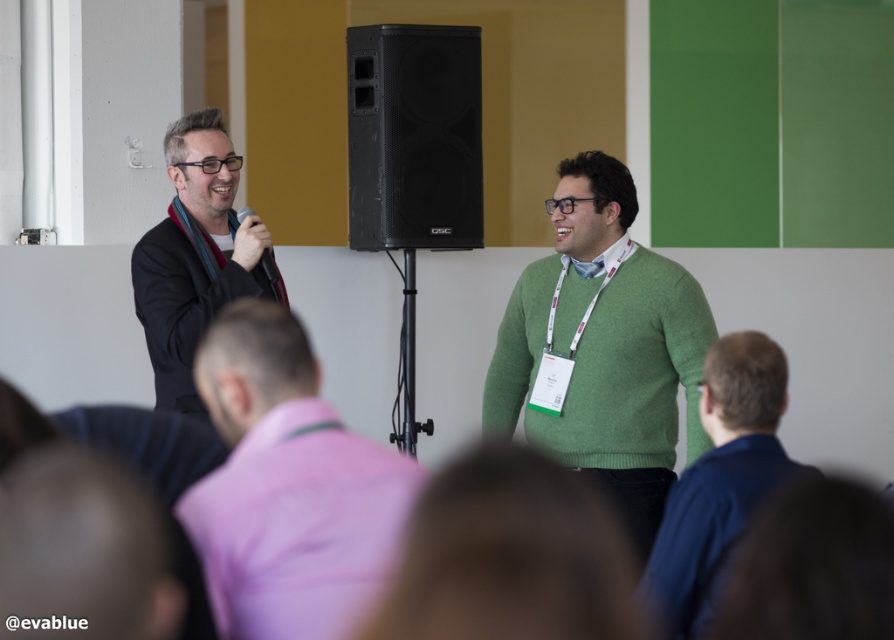
Between point (679, 317) and point (275, 278), which one is positioned in front?

Point (679, 317) is more forward.

The image size is (894, 640). Identify the location of green wool sweater at center. (604, 346).

Between point (630, 381) and point (268, 266), which one is positioned behind?

Positioned behind is point (268, 266).

At what (x,y) coordinates should I click in order to perform the action: click on green wool sweater at center. Please return your answer as a coordinate pair (x, y). This screenshot has height=640, width=894. Looking at the image, I should click on (604, 346).

Is black matte speaker at center thinner than matte black suit at left?

Incorrect, black matte speaker at center's width is not less than matte black suit at left's.

In the scene shown: Is black matte speaker at center wider than matte black suit at left?

Yes.

What do you see at coordinates (414, 136) in the screenshot? I see `black matte speaker at center` at bounding box center [414, 136].

The height and width of the screenshot is (640, 894). I want to click on black matte speaker at center, so click(x=414, y=136).

Does green wool sweater at center lie behind matte black suit at left?

That is True.

Which is behind, point (530, 349) or point (137, 298)?

The point (530, 349) is behind.

Measure the distance between green wool sweater at center and camera.

green wool sweater at center and camera are 4.58 meters apart from each other.

Where is `green wool sweater at center`? This screenshot has height=640, width=894. green wool sweater at center is located at coordinates (604, 346).